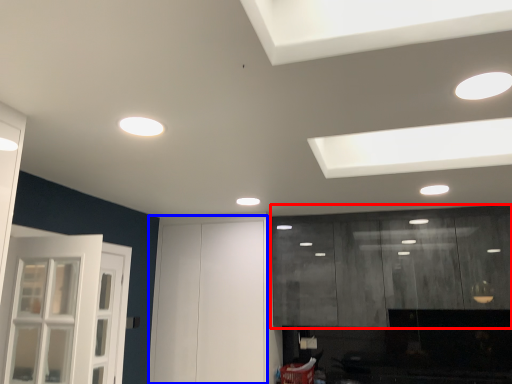
Question: Which point is further to the camera, cabinetry (highlighted by a red box) or door (highlighted by a blue box)?

Choices:
 (A) cabinetry
 (B) door

Answer: (B)